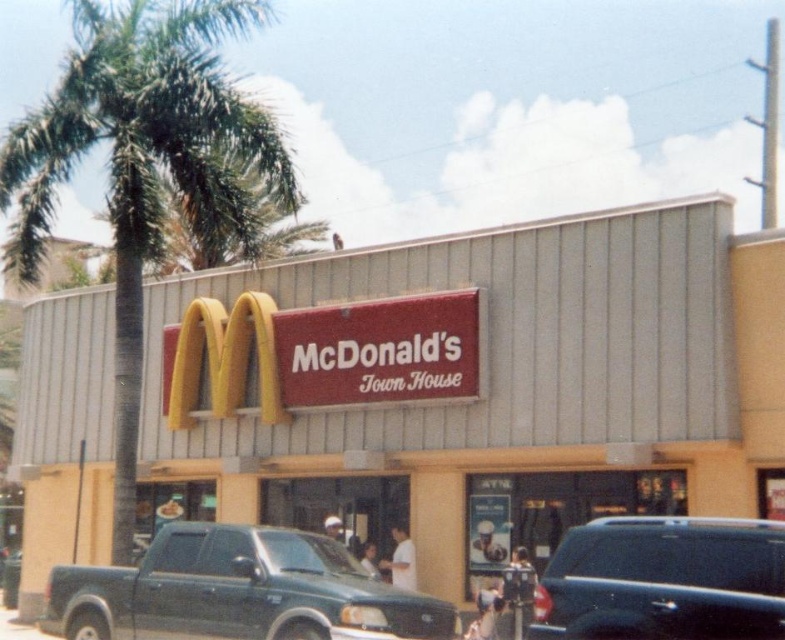
Question: Which point is closer to the camera taking this photo?

Choices:
 (A) (718, 616)
 (B) (88, 80)

Answer: (A)

Question: In this image, where is green matte truck at lower left located relative to shiny black suv at lower right?

Choices:
 (A) above
 (B) below

Answer: (B)

Question: Is red signboard at center positioned at the back of green leafy palm tree at left?

Choices:
 (A) yes
 (B) no

Answer: (B)

Question: Which point is farther from the camera taking this photo?

Choices:
 (A) (590, 550)
 (B) (320, 476)

Answer: (B)

Question: Does green leafy palm tree at left have a larger size compared to shiny black suv at lower right?

Choices:
 (A) no
 (B) yes

Answer: (B)

Question: Which object is the farthest from the shiny black suv at lower right?

Choices:
 (A) red signboard at center
 (B) green leafy palm tree at left
 (C) green matte truck at lower left

Answer: (B)